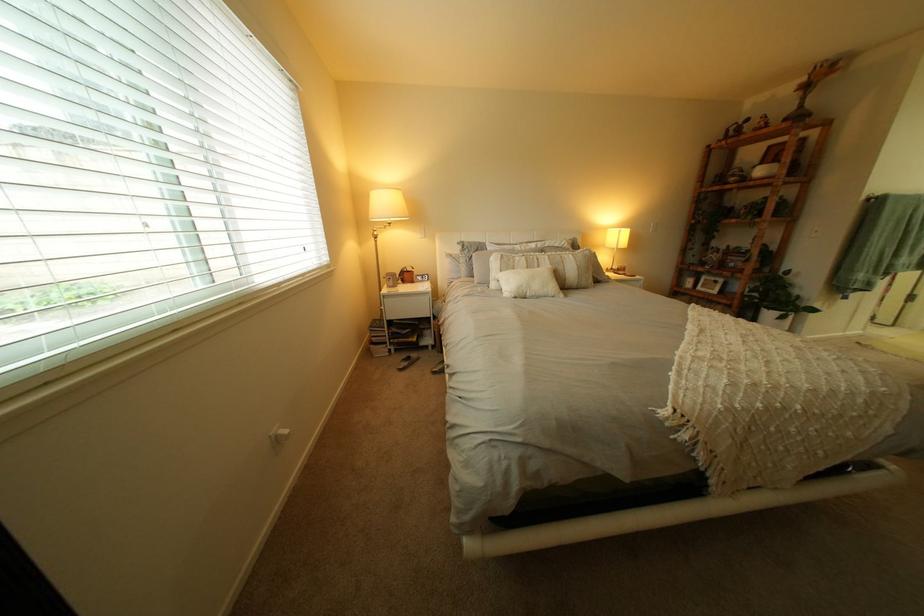
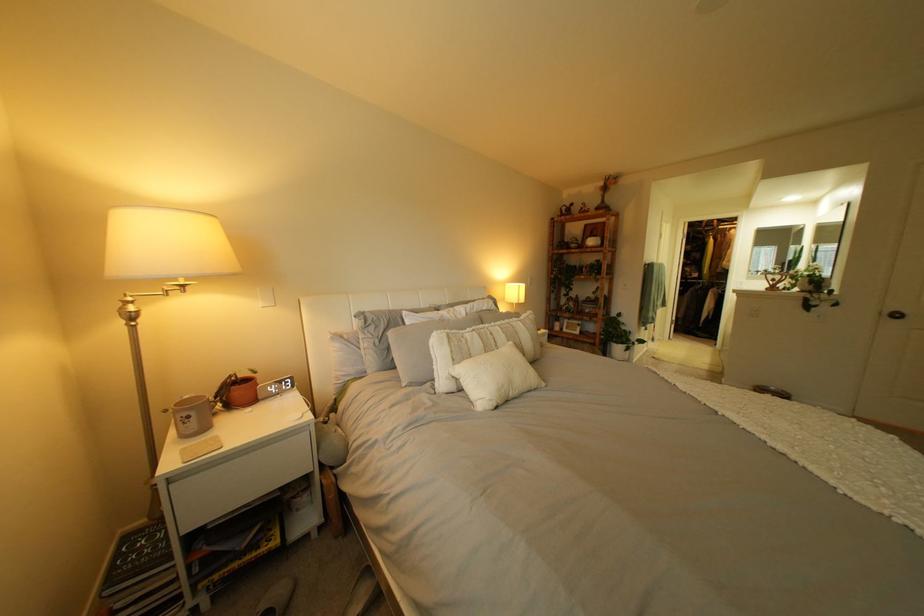
Find the pixel in the second image that matches point (388, 233) in the first image.

(139, 310)